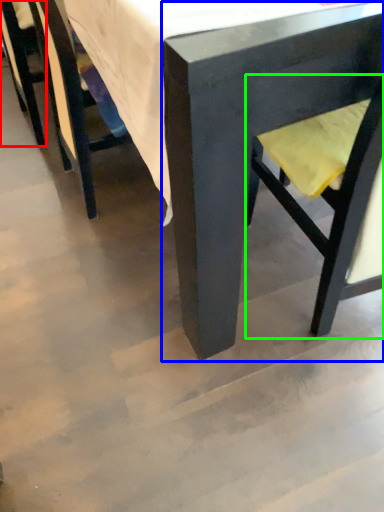
Question: Based on their relative distances, which object is farther from chair (highlighted by a red box)? Choose from chair (highlighted by a blue box) and swivel chair (highlighted by a green box).

Choices:
 (A) chair
 (B) swivel chair

Answer: (A)